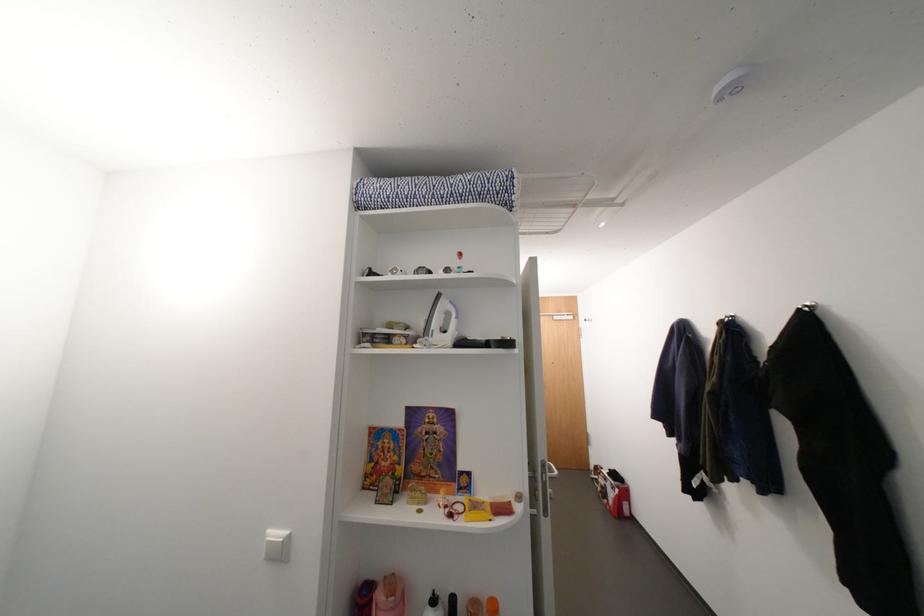
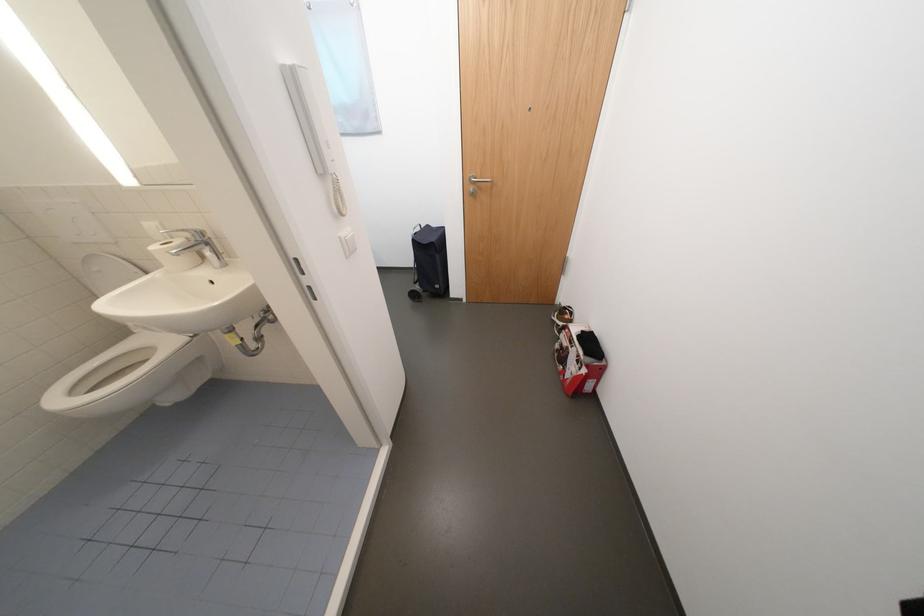
The point at (625, 492) is marked in the first image. Where is the corresponding point in the second image?

(592, 371)